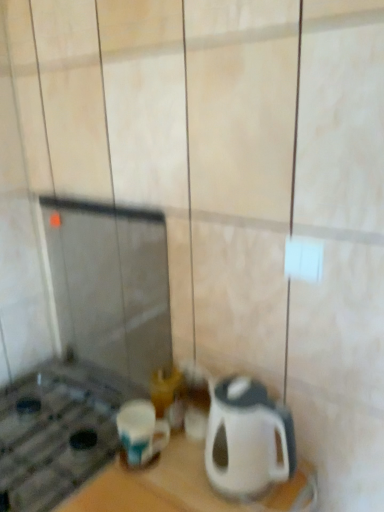
Measure the distance between point (230, 394) and camera.

The depth of point (230, 394) is 36.65 inches.

What do you see at coordinates (247, 438) in the screenshot?
I see `white glossy kettle at lower right` at bounding box center [247, 438].

Locate an element on the screen. This screenshot has height=512, width=384. white glossy kettle at lower right is located at coordinates (247, 438).

The image size is (384, 512). Find the location of `blue glossy mug at lower left`. blue glossy mug at lower left is located at coordinates (141, 431).

What do you see at coordinates (141, 431) in the screenshot? I see `blue glossy mug at lower left` at bounding box center [141, 431].

The height and width of the screenshot is (512, 384). In order to click on white glossy kettle at lower right in this screenshot , I will do pos(247,438).

Considering the positions of objects white glossy kettle at lower right and blue glossy mug at lower left in the image provided, who is more to the right, white glossy kettle at lower right or blue glossy mug at lower left?

From the viewer's perspective, white glossy kettle at lower right appears more on the right side.

Considering the positions of objects white glossy kettle at lower right and blue glossy mug at lower left in the image provided, who is behind, white glossy kettle at lower right or blue glossy mug at lower left?

blue glossy mug at lower left is further from the camera.

Is point (253, 396) positioned before point (133, 415)?

Yes, it is.

From the image's perspective, is white glossy kettle at lower right on top of blue glossy mug at lower left?

Yes, from the image's perspective, white glossy kettle at lower right is over blue glossy mug at lower left.

From a real-world perspective, is white glossy kettle at lower right under blue glossy mug at lower left?

Incorrect, from a real-world perspective, white glossy kettle at lower right is higher than blue glossy mug at lower left.

Considering the sizes of objects white glossy kettle at lower right and blue glossy mug at lower left in the image provided, who is wider, white glossy kettle at lower right or blue glossy mug at lower left?

white glossy kettle at lower right is wider.

Considering the sizes of objects white glossy kettle at lower right and blue glossy mug at lower left in the image provided, who is shorter, white glossy kettle at lower right or blue glossy mug at lower left?

blue glossy mug at lower left.

Considering the relative sizes of white glossy kettle at lower right and blue glossy mug at lower left in the image provided, is white glossy kettle at lower right smaller than blue glossy mug at lower left?

No.

Would you say blue glossy mug at lower left is part of white glossy kettle at lower right's contents?

No, blue glossy mug at lower left is not surrounded by white glossy kettle at lower right.

Is white glossy kettle at lower right far away from blue glossy mug at lower left?

No, white glossy kettle at lower right is not far away from blue glossy mug at lower left.

Is white glossy kettle at lower right looking in the opposite direction of blue glossy mug at lower left?

No, blue glossy mug at lower left is not at the back of white glossy kettle at lower right.

How many degrees apart are the facing directions of white glossy kettle at lower right and blue glossy mug at lower left?

The facing directions of white glossy kettle at lower right and blue glossy mug at lower left are 0.952 degrees apart.

Where is `kitchen appliance that appears above the blue glossy mug at lower left (from a real-world perspective)`? Image resolution: width=384 pixels, height=512 pixels. kitchen appliance that appears above the blue glossy mug at lower left (from a real-world perspective) is located at coordinates (247, 438).

Considering the relative positions of blue glossy mug at lower left and white glossy kettle at lower right in the image provided, is blue glossy mug at lower left to the left or to the right of white glossy kettle at lower right?

In the image, blue glossy mug at lower left appears on the left side of white glossy kettle at lower right.

Is the depth of blue glossy mug at lower left less than that of white glossy kettle at lower right?

No, blue glossy mug at lower left is further to the viewer.

Which is farther, (125, 443) or (271, 441)?

The point (125, 443) is behind.

From the image's perspective, would you say blue glossy mug at lower left is positioned over white glossy kettle at lower right?

No.

From a real-world perspective, who is located lower, blue glossy mug at lower left or white glossy kettle at lower right?

From a 3D spatial view, blue glossy mug at lower left is below.

Which object is wider, blue glossy mug at lower left or white glossy kettle at lower right?

white glossy kettle at lower right is wider.

From their relative heights in the image, would you say blue glossy mug at lower left is taller or shorter than white glossy kettle at lower right?

Clearly, blue glossy mug at lower left is shorter compared to white glossy kettle at lower right.

Between blue glossy mug at lower left and white glossy kettle at lower right, which one has larger size?

white glossy kettle at lower right is bigger.

Is white glossy kettle at lower right completely or partially inside blue glossy mug at lower left?

No, blue glossy mug at lower left does not contain white glossy kettle at lower right.

Would you say blue glossy mug at lower left is a long distance from white glossy kettle at lower right?

blue glossy mug at lower left is actually quite close to white glossy kettle at lower right.

Is blue glossy mug at lower left looking in the opposite direction of white glossy kettle at lower right?

No.

Measure the distance between blue glossy mug at lower left and white glossy kettle at lower right.

blue glossy mug at lower left and white glossy kettle at lower right are 9.15 inches apart from each other.

Locate an element on the screen. The height and width of the screenshot is (512, 384). kitchen appliance that appears above the blue glossy mug at lower left (from a real-world perspective) is located at coordinates coord(247,438).

This screenshot has height=512, width=384. In order to click on kitchen appliance above the blue glossy mug at lower left (from a real-world perspective) in this screenshot , I will do `click(247, 438)`.

I want to click on coffee cup that appears behind the white glossy kettle at lower right, so click(141, 431).